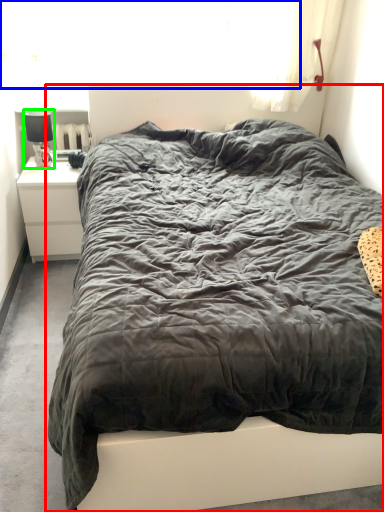
Question: Which is nearer to the bed (highlighted by a red box)? window screen (highlighted by a blue box) or lamp (highlighted by a green box).

Choices:
 (A) window screen
 (B) lamp

Answer: (A)